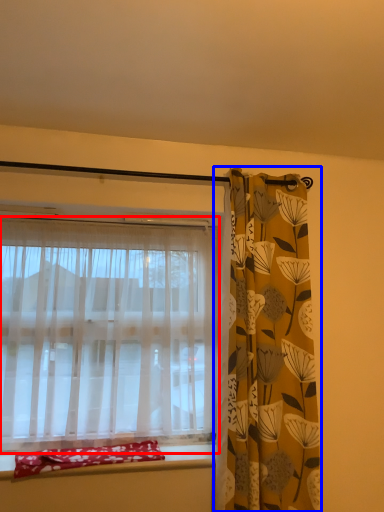
Question: Among these objects, which one is nearest to the camera, curtain (highlighted by a red box) or curtain (highlighted by a blue box)?

Choices:
 (A) curtain
 (B) curtain

Answer: (B)